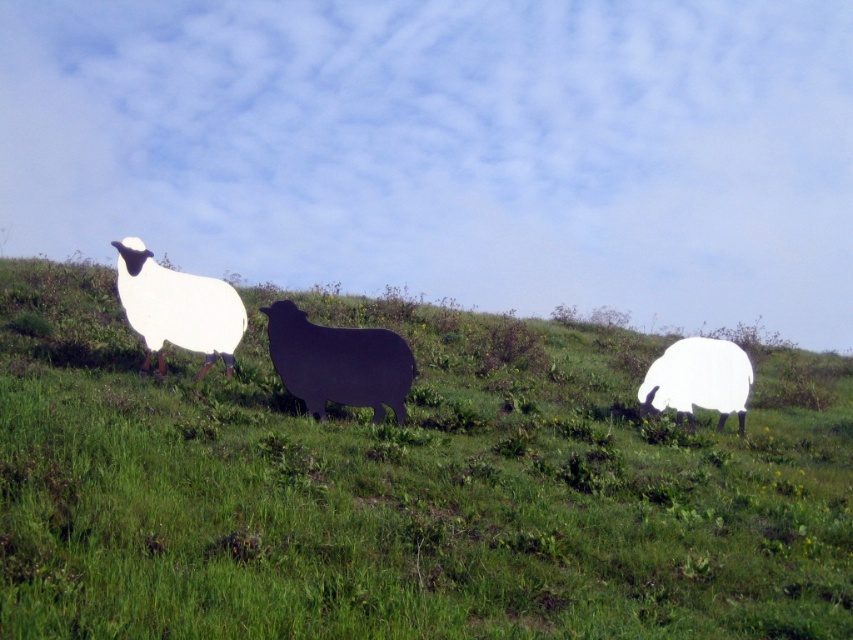
You are a drone operator trying to capture the best aerial shot of the green grassy at center and the white matte sheep at right. Based on their positions, which object would appear lower in your camera view?

The white matte sheep at right would appear lower in the camera view since the green grassy at center is located above it.

You are standing at the base of the hill looking up at the three sheep figures. Which of the two points, point (120,280) or point (654,376), is closer to you?

Point (120,280) is closer to you than point (654,376).